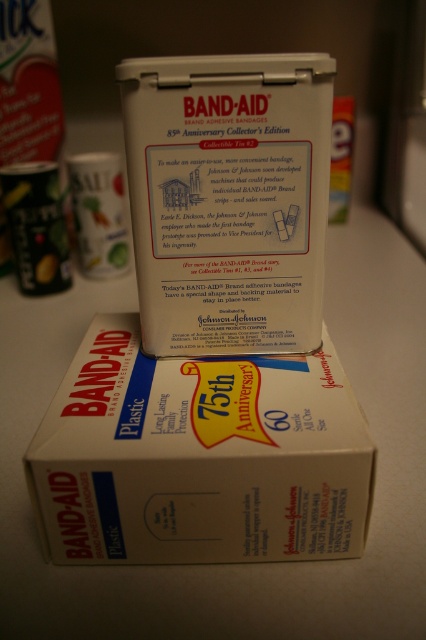
Question: Is white plastic box at center bigger than white matte tin at upper center?

Choices:
 (A) yes
 (B) no

Answer: (A)

Question: Can you confirm if white plastic box at center is bigger than white matte tin at upper center?

Choices:
 (A) no
 (B) yes

Answer: (B)

Question: Which of the following is the farthest from the observer?

Choices:
 (A) (176, 493)
 (B) (167, 308)

Answer: (B)

Question: Among these points, which one is nearest to the camera?

Choices:
 (A) (296, 234)
 (B) (261, 369)

Answer: (A)

Question: In this image, where is white plastic box at center located relative to white matte tin at upper center?

Choices:
 (A) right
 (B) left

Answer: (B)